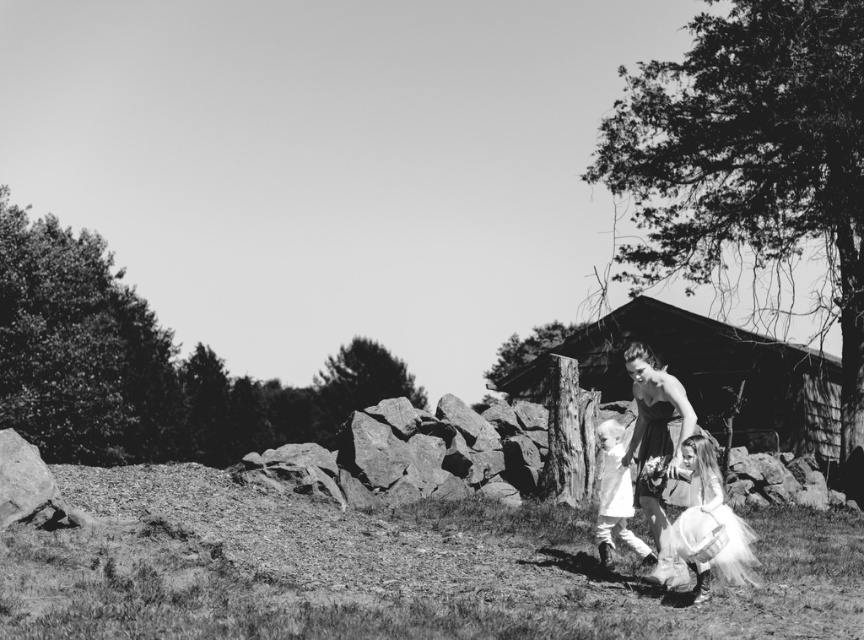
Question: Can you confirm if wooden hut at center is smaller than matte black dress at center?

Choices:
 (A) no
 (B) yes

Answer: (A)

Question: Can you confirm if matte black dress at center is positioned to the left of white soft dress at center?

Choices:
 (A) yes
 (B) no

Answer: (B)

Question: Which object appears farthest from the camera in this image?

Choices:
 (A) white soft dress at center
 (B) matte black dress at center
 (C) wooden hut at center
 (D) white tulle dress at lower right

Answer: (C)

Question: Which point is farther to the camera?

Choices:
 (A) (704, 438)
 (B) (639, 342)
 (C) (804, 444)
 (D) (599, 445)

Answer: (C)

Question: Is matte black dress at center thinner than white tulle dress at lower right?

Choices:
 (A) yes
 (B) no

Answer: (A)

Question: Among these objects, which one is farthest from the camera?

Choices:
 (A) matte black dress at center
 (B) wooden hut at center
 (C) white soft dress at center

Answer: (B)